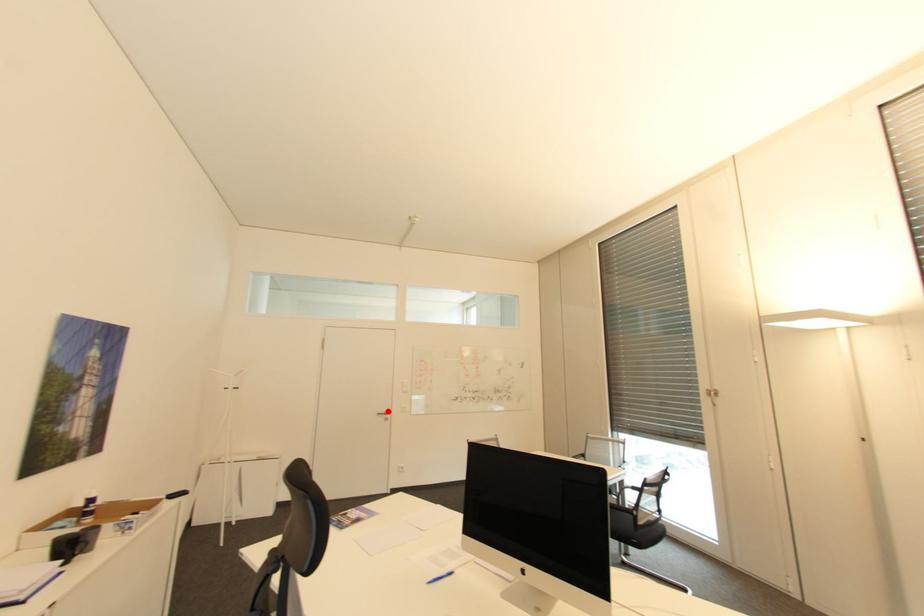
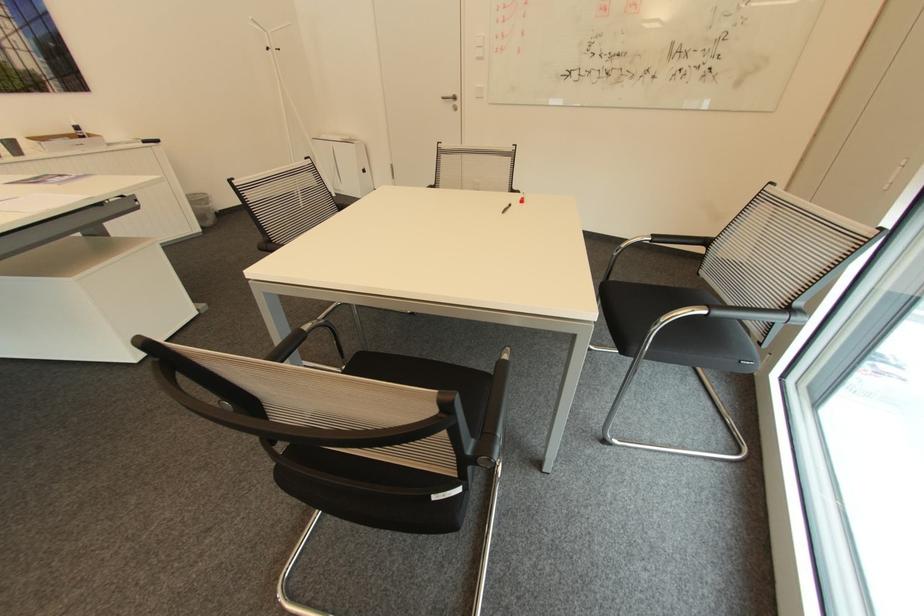
Question: I am providing you with two images of the same scene from different viewpoints. A red point is shown in image1. For the corresponding object point in image2, is it positioned nearer or farther from the camera?

Choices:
 (A) Nearer
 (B) Farther

Answer: (A)